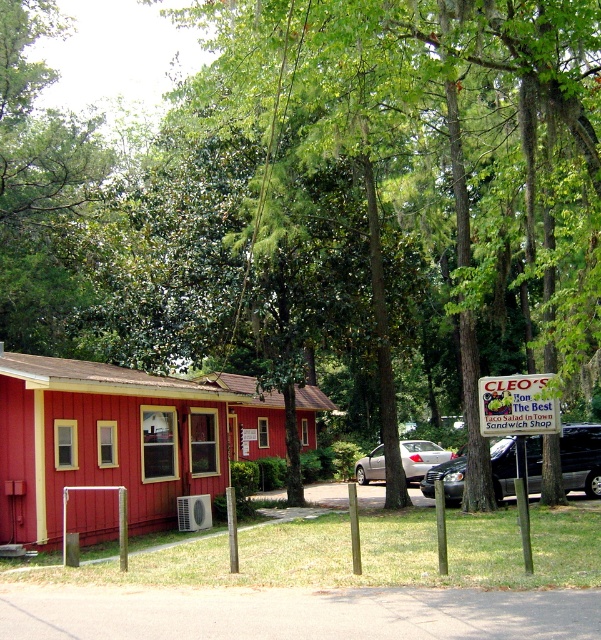
You are a customer driving a car with a width of 1.8 meters. You want to park your car between the green leafy tree at center and the silver metallic sedan at center. Is there enough space between them for your car?

The green leafy tree at center is wider than the silver metallic sedan at center, but the description does not provide the exact distance between them. Therefore, it is unclear if there is enough space for a car with a width of 1.8 meters to park between them.

You are standing in front of the red wood cabin at center and want to get to the silver metallic sedan at center. Which direction should you move to reach the sedan?

Since the red wood cabin at center is closer to you than the silver metallic sedan at center, you should move forward away from the cabin towards the sedan.

You are standing at the edge of the grassy area near the wooden posts. You want to walk to the entrance of Cleo s Sandwich Shop. Is the green leafy tree at center in your way?

The green leafy tree at center is 30.78 feet away from you, so it is not blocking your path to the entrance of Cleo s Sandwich Shop.